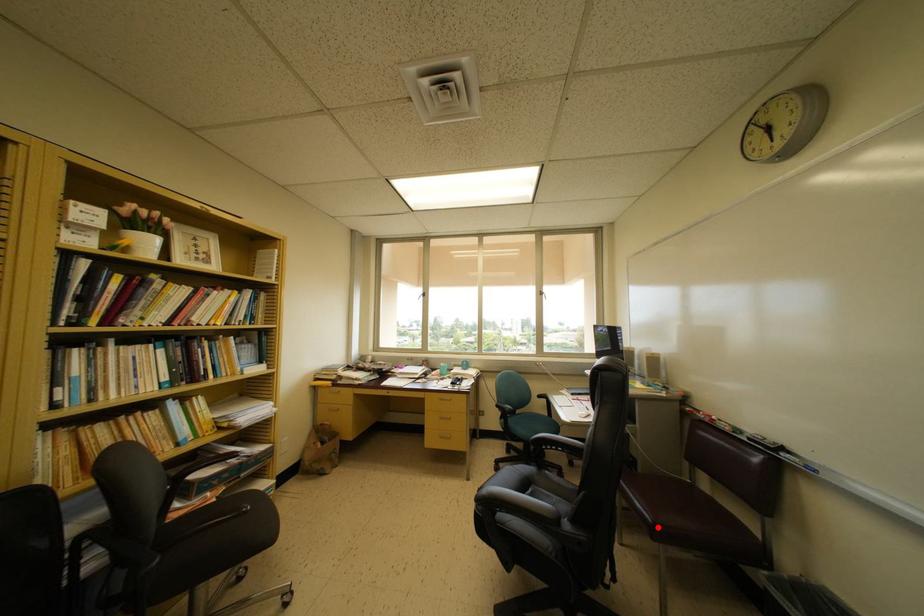
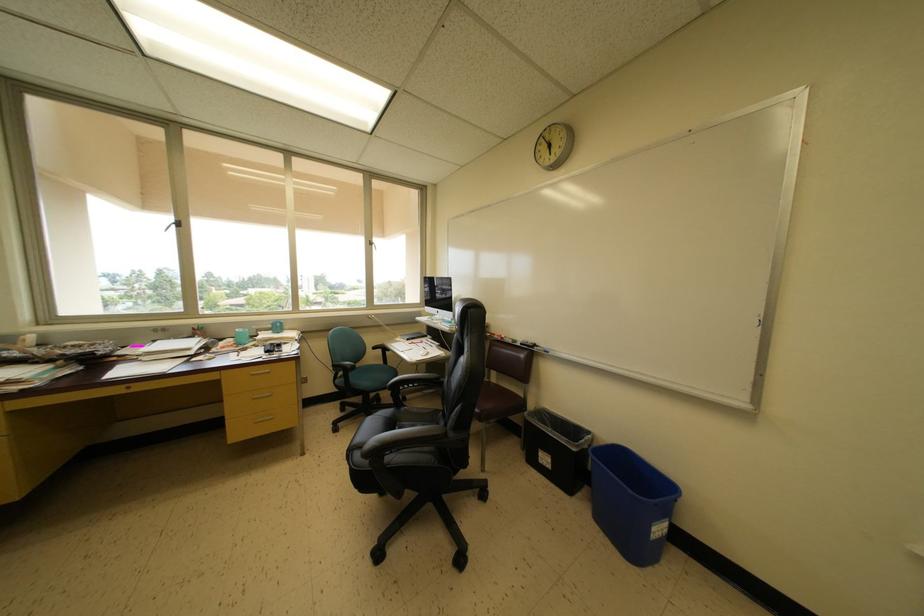
Find the pixel in the second image that matches the highlighted location in the first image.

(485, 416)